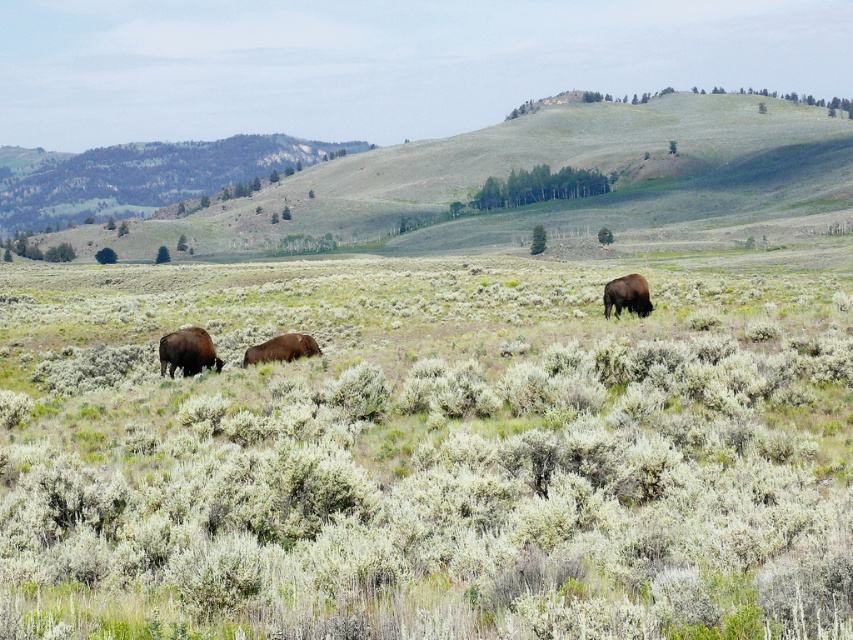
From the picture: You are a photographer standing in the open field and want to take a picture of the brown furry bison at left and the brown fur bison at right. Which bison will appear closer to the camera in the photo?

The brown furry bison at left will appear closer to the camera in the photo because it is positioned in front of the brown fur bison at right.

You are a wildlife photographer trying to capture a photo of the brown fur bison at right and the brown furry bison at center. Which bison should you focus on if you want to highlight the larger animal in your shot?

The brown furry bison at center is wider than the brown fur bison at right, so focusing on the brown furry bison at center will highlight the larger animal in your shot.